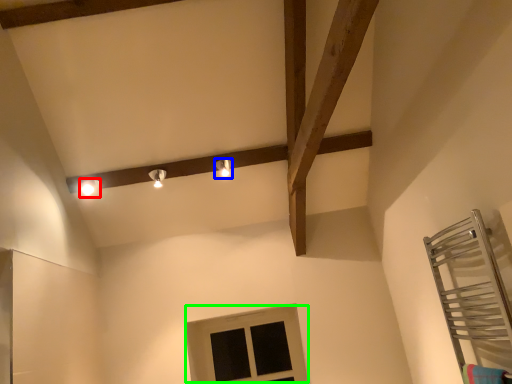
Question: Estimate the real-world distances between objects in this image. Which object is farther from light fixture (highlighted by a red box), light fixture (highlighted by a blue box) or window (highlighted by a green box)?

Choices:
 (A) light fixture
 (B) window

Answer: (B)